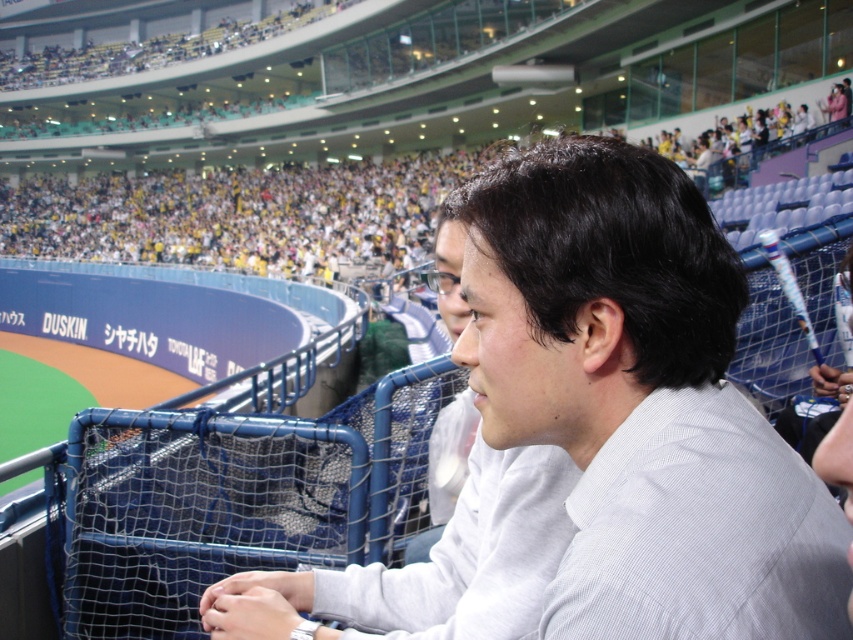
You are standing at the point labeled as point (473, 304) in the baseball stadium. You want to toss a baseball to a friend who is standing 1.5 meters away from you. Will your throw reach them?

The distance between you and the friend is 1.46 meters, which is less than 1.5 meters. Therefore, your throw will reach them.

You are a photographer standing at the edge of the baseball stadium stands. You see the white textured shirt at center and the white cotton shirt at center. You want to take a photo of both shirts in the same frame. Given that your camera has a minimum focus distance of 15 inches, can you capture both shirts clearly without moving your position?

The white textured shirt at center is 18.80 inches from the white cotton shirt at center. Since the distance between them is greater than the camera minimum focus distance of 15 inches, you can capture both shirts clearly in the same frame without moving your position.

You are a photographer trying to capture a candid shot of the two individuals in the stands. You notice both the white textured shirt at center and the white cotton shirt at center. Which shirt should you focus on to ensure your camera can fully capture the person wearing it in the frame, considering their shirt width?

The white cotton shirt at center has a greater width than the white textured shirt at center, so focusing on the person wearing the white cotton shirt at center would allow the camera to capture more of their body in the frame.